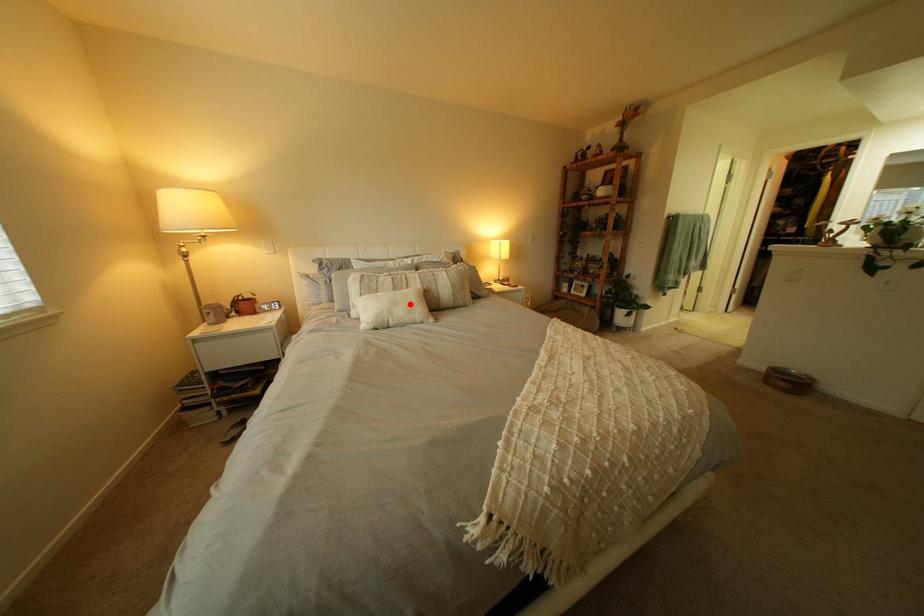
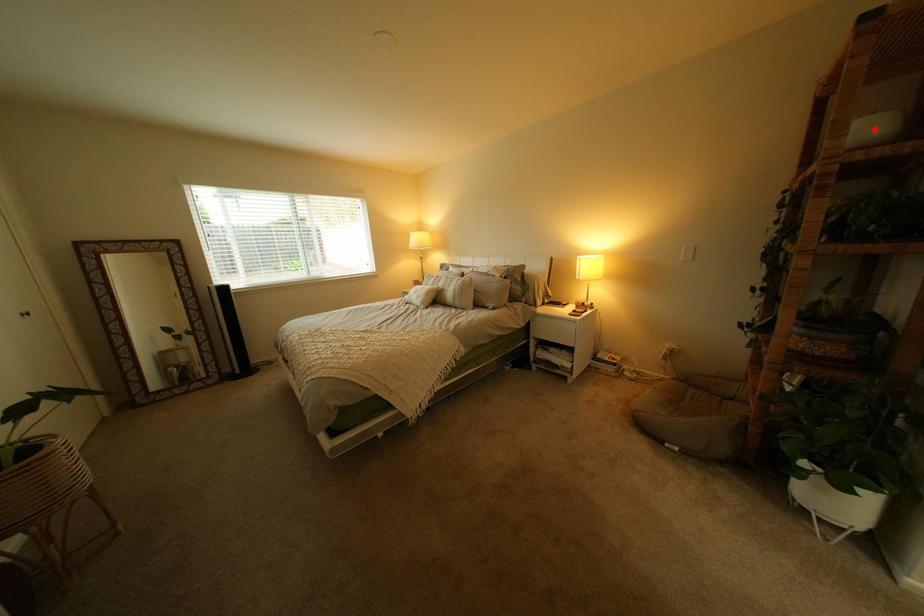
I am providing you with two images of the same scene from different viewpoints. A red point is marked on the first image and another point is marked on the second image. Is the marked point in image1 the same physical position as the marked point in image2?

No